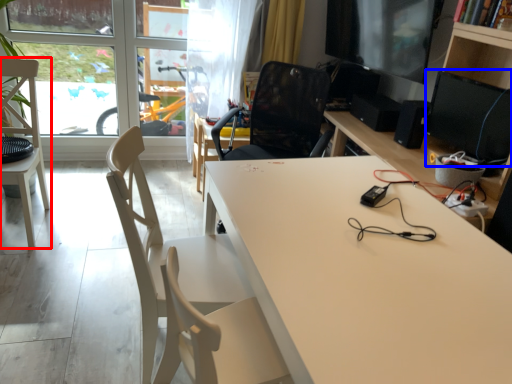
Question: Among these objects, which one is nearest to the camera, chair (highlighted by a red box) or computer monitor (highlighted by a blue box)?

Choices:
 (A) chair
 (B) computer monitor

Answer: (B)